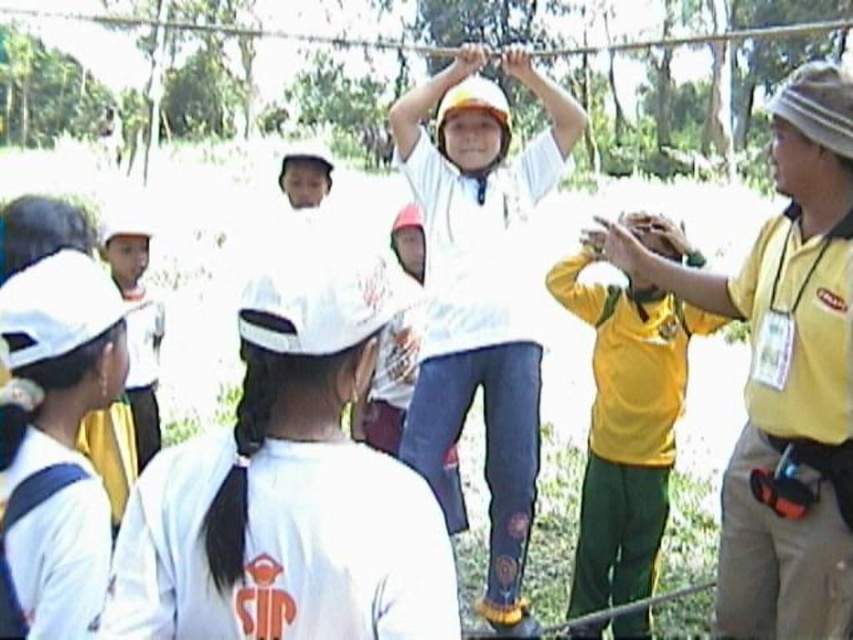
You are a photographer trying to capture a clear shot of the yellow fabric shirt at right and the white matte uniform at lower left. Which one will appear larger in your photo?

The yellow fabric shirt at right is closer to the photographer than the white matte uniform at lower left, so it will appear larger in the photo.

You are a photographer trying to capture a clear photo of the white matte shirt at center and the white matte hoodie at center. Since both are white, you need to adjust your camera settings to differentiate them. Which object should you focus on to ensure the thinner one is in sharp focus?

The white matte shirt at center is thinner than the white matte hoodie at center, so you should focus on the white matte shirt at center to ensure the thinner one is in sharp focus.

Based on the photo, you are a photographer setting up for a group photo in the park. You have two subjects to focus on the yellow fabric shirt at right and the white matte uniform at lower left. Which subject has a wider torso to accommodate a larger camera lens? Please base your answer on the scene description provided.

The yellow fabric shirt at right has a wider torso than the white matte uniform at lower left, so the photographer should focus the larger camera lens on the yellow fabric shirt at right.